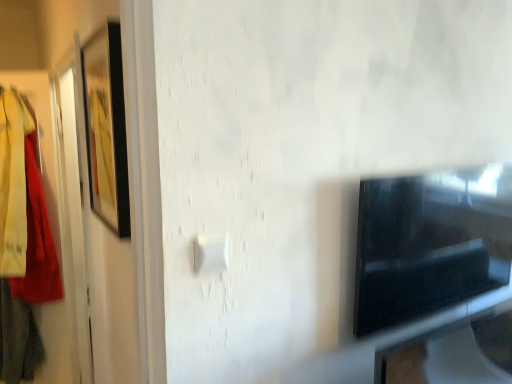
Question: In the image, is white plastic light switch at center on the left side or the right side of matte black picture frame at left?

Choices:
 (A) left
 (B) right

Answer: (B)

Question: Is white plastic light switch at center situated inside matte black picture frame at left or outside?

Choices:
 (A) outside
 (B) inside

Answer: (A)

Question: Which object is the closest to the matte black picture frame at left?

Choices:
 (A) white plastic light switch at center
 (B) black glossy tv at right

Answer: (A)

Question: Estimate the real-world distances between objects in this image. Which object is closer to the white plastic light switch at center?

Choices:
 (A) black glossy tv at right
 (B) matte black picture frame at left

Answer: (B)